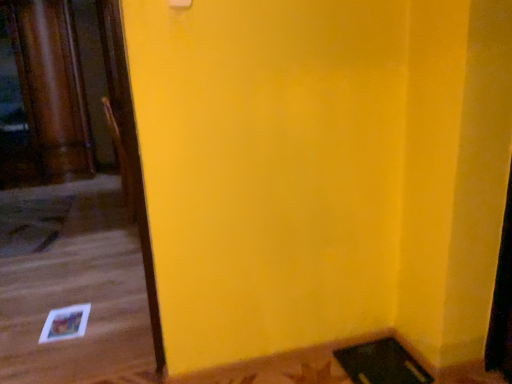
Question: Is rug at lower left inside or outside of wooden chair at left?

Choices:
 (A) inside
 (B) outside

Answer: (B)

Question: Does point (59, 220) appear closer or farther from the camera than point (117, 129)?

Choices:
 (A) closer
 (B) farther

Answer: (B)

Question: In terms of size, does rug at lower left appear bigger or smaller than wooden chair at left?

Choices:
 (A) small
 (B) big

Answer: (A)

Question: In terms of width, does wooden chair at left look wider or thinner when compared to rug at lower left?

Choices:
 (A) thin
 (B) wide

Answer: (A)

Question: Considering the relative positions of wooden chair at left and rug at lower left in the image provided, is wooden chair at left to the left or to the right of rug at lower left?

Choices:
 (A) left
 (B) right

Answer: (B)

Question: Is wooden chair at left inside or outside of rug at lower left?

Choices:
 (A) outside
 (B) inside

Answer: (A)

Question: Considering the positions of wooden chair at left and rug at lower left in the image, is wooden chair at left bigger or smaller than rug at lower left?

Choices:
 (A) big
 (B) small

Answer: (A)